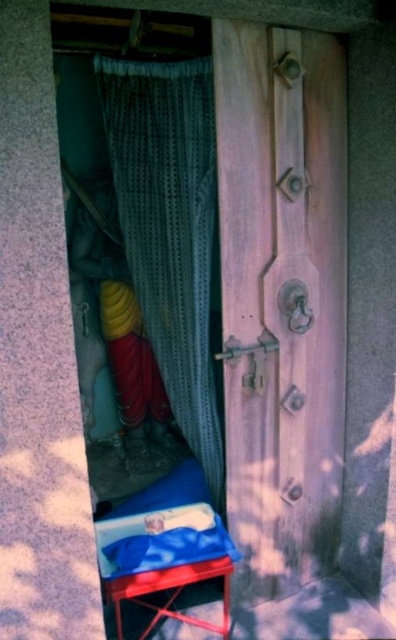
Where is `wooden door at center`? wooden door at center is located at coordinates (281, 298).

What do you see at coordinates (281, 298) in the screenshot? This screenshot has height=640, width=396. I see `wooden door at center` at bounding box center [281, 298].

Measure the distance between point (327, 388) and camera.

Point (327, 388) and camera are 7.84 feet apart from each other.

Locate an element on the screen. Image resolution: width=396 pixels, height=640 pixels. wooden door at center is located at coordinates pos(281,298).

Can you confirm if wooden door at center is wider than metallic red stool at lower center?

Yes, wooden door at center is wider than metallic red stool at lower center.

Which is in front, point (335, 474) or point (220, 561)?

Positioned in front is point (220, 561).

Where is `wooden door at center`? The height and width of the screenshot is (640, 396). wooden door at center is located at coordinates (281, 298).

Does point (190, 150) come farther from viewer compared to point (226, 611)?

No, (190, 150) is closer to viewer.

Does point (100, 80) come farther from viewer compared to point (125, 582)?

Yes, it is behind point (125, 582).

Find the location of a particular element. textured fabric curtain at center is located at coordinates (169, 227).